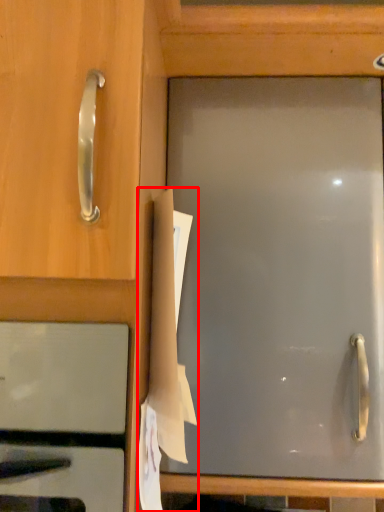
Question: In this image, where is paper (annotated by the red box) located relative to oven?

Choices:
 (A) right
 (B) left

Answer: (A)